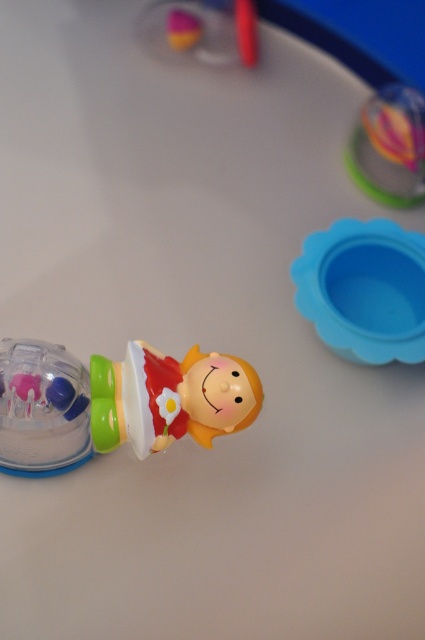
Question: Can you confirm if translucent plastic doll at center is positioned to the right of translucent plastic ball at upper right?

Choices:
 (A) no
 (B) yes

Answer: (A)

Question: Which of the following is the closest to the observer?

Choices:
 (A) blue rubber bowl at center right
 (B) translucent plastic doll at center
 (C) transparent plastic spinner at left
 (D) translucent plastic ball at upper right

Answer: (B)

Question: Can you confirm if blue rubber bowl at center right is positioned below translucent plastic ball at upper right?

Choices:
 (A) yes
 (B) no

Answer: (A)

Question: Which object is the closest to the translucent plastic ball at upper right?

Choices:
 (A) blue rubber bowl at center right
 (B) transparent plastic spinner at left
 (C) translucent plastic doll at center

Answer: (A)

Question: Which of the following is the closest to the observer?

Choices:
 (A) (110, 406)
 (B) (345, 250)
 (C) (413, 129)

Answer: (A)

Question: Can you confirm if translucent plastic doll at center is positioned below translucent plastic ball at upper right?

Choices:
 (A) yes
 (B) no

Answer: (A)